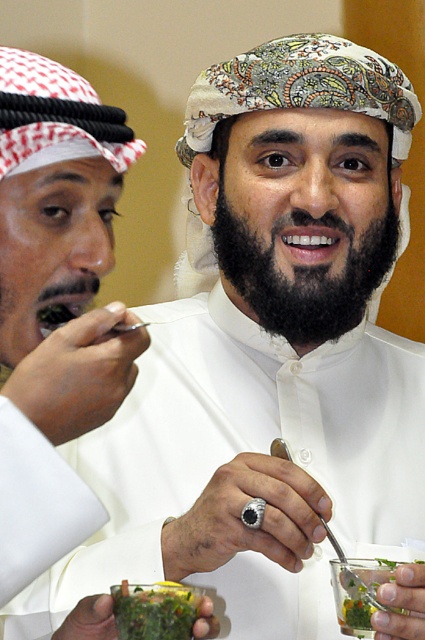
You are a photographer trying to capture both the black matte beard at center and the green leafy salad at lower right in a single frame. Which object should you focus on first to ensure both are in the frame?

You should focus on the black matte beard at center first because it might be wider than the green leafy salad at lower right, so centering it will help include both in the frame.

You are a food critic visiting a Middle Eastern restaurant and see the image. You want to describe the location of the point marked at coordinates (155, 609). Based on the scene, where exactly is this point located?

The point at coordinates (155, 609) is located on the green leafy salad at center.

You are a photographer standing at the camera position. You want to take a closeup shot of the black matte beard at center. What is the minimum distance you need to move forward to ensure the beard fills the frame?

The minimum distance you need to move forward is 1.08 meters, as that is the current distance between the black matte beard at center and the camera.